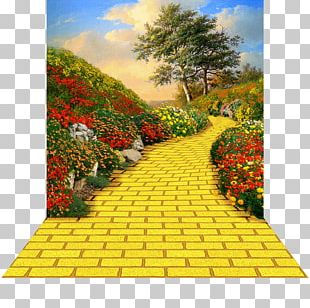
In order to click on yellow plant in this screenshot , I will do 77,69, 169,116, 242,112, 257,127, 260,192, 251,89.